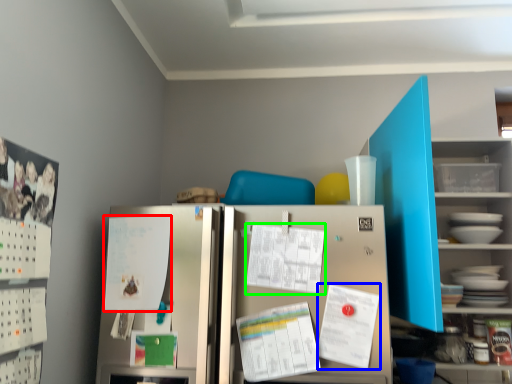
Question: Estimate the real-world distances between objects in this image. Which object is closer to paper (highlighted by a red box), paper (highlighted by a blue box) or paper (highlighted by a green box)?

Choices:
 (A) paper
 (B) paper

Answer: (B)